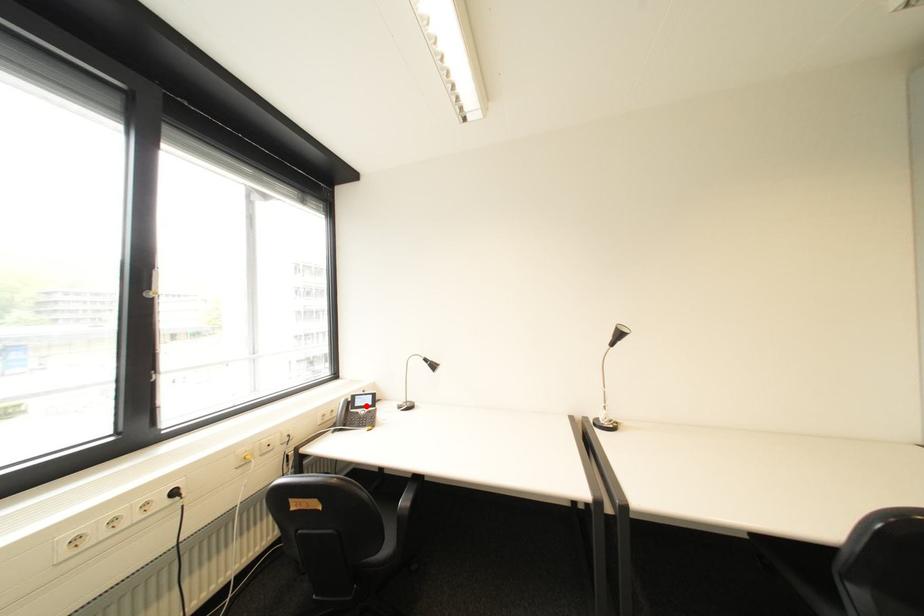
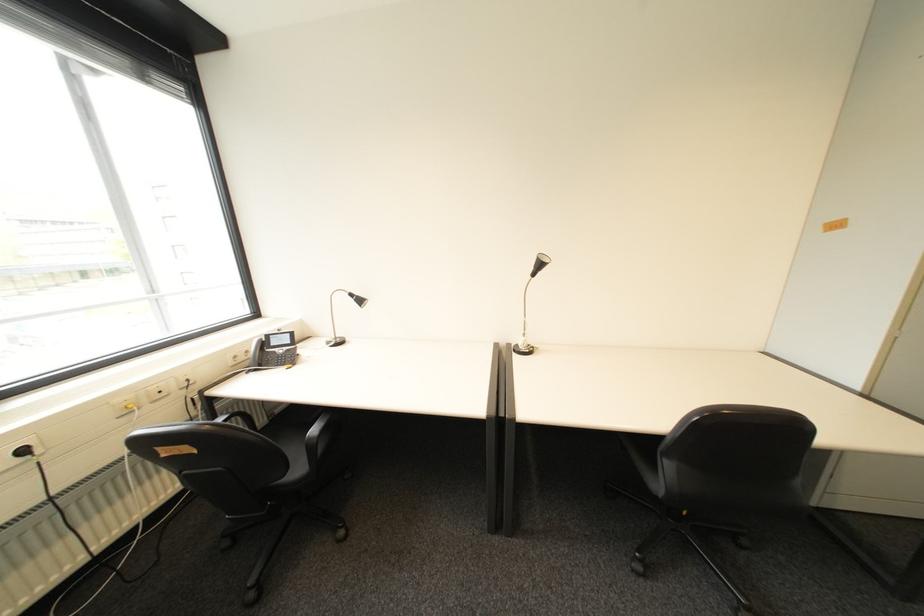
Locate, in the second image, the point that corresponds to the highlighted location in the first image.

(283, 345)